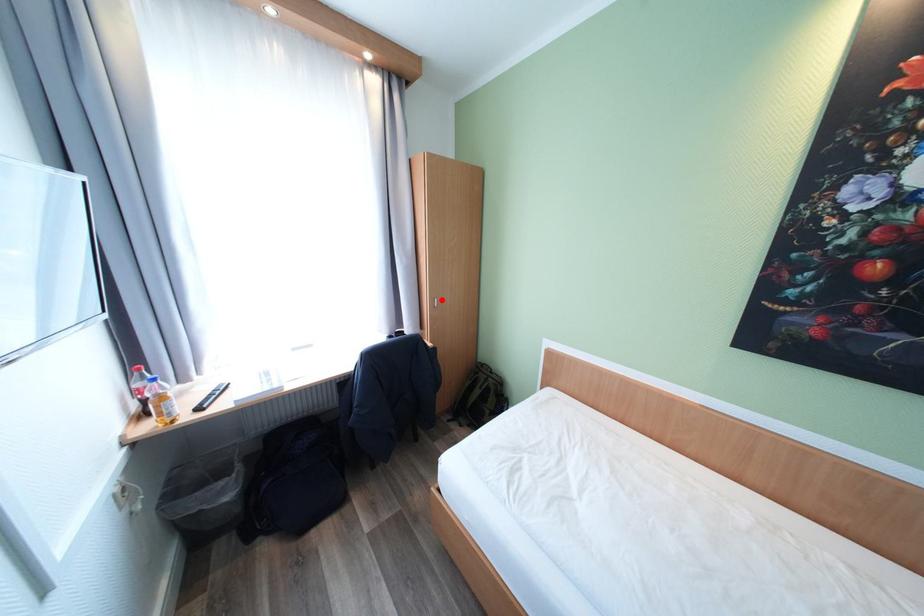
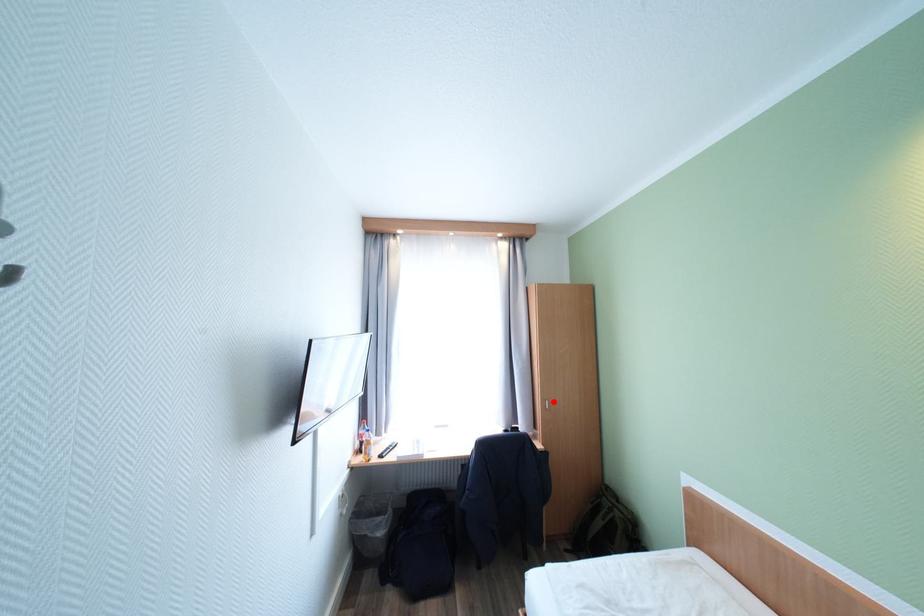
I am providing you with two images of the same scene from different viewpoints. A red point is marked on the first image and another point is marked on the second image. Does the point marked in image1 correspond to the same location as the one in image2?

Yes